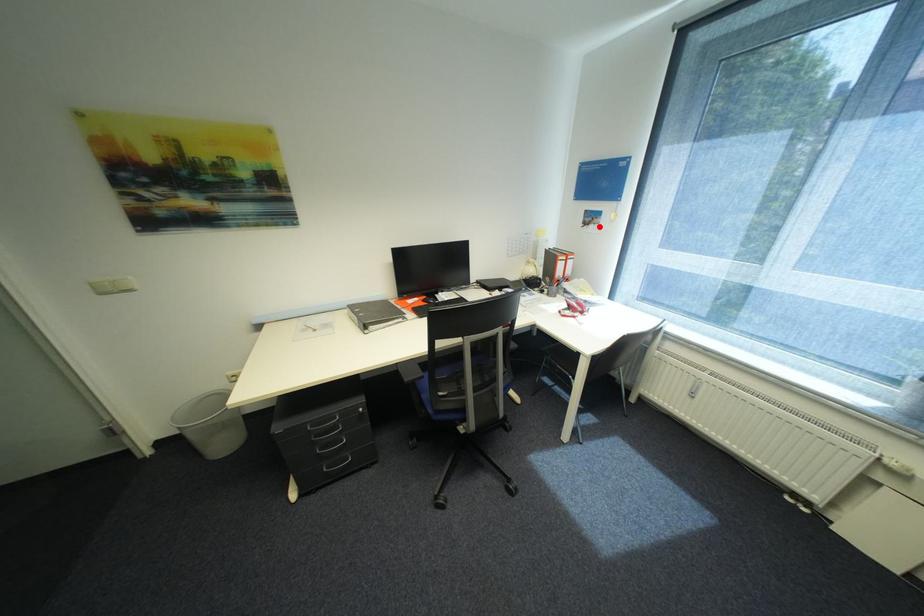
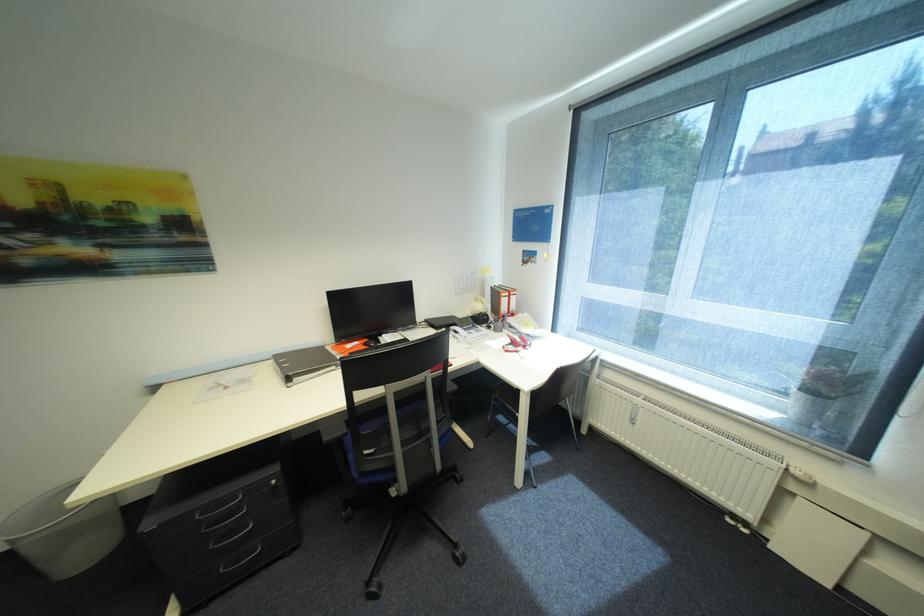
Question: I am providing you with two images of the same scene from different viewpoints. Given a red point in image1, look at the same physical point in image2. Is it:

Choices:
 (A) Closer to the viewpoint
 (B) Farther from the viewpoint

Answer: (B)